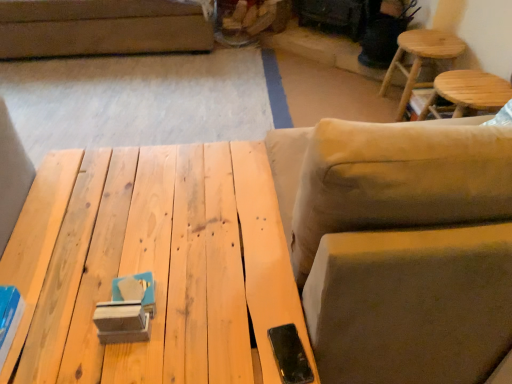
Question: Should I look upward or downward to see beige fabric swivel chair at right?

Choices:
 (A) down
 (B) up

Answer: (B)

Question: From a real-world perspective, is beige fabric swivel chair at right on light brown wooden stool at upper right, which ranks as the 1th stool in back-to-front order?

Choices:
 (A) yes
 (B) no

Answer: (A)

Question: Does beige fabric swivel chair at right have a lesser width compared to light brown wooden stool at upper right, which ranks as the 1th stool in back-to-front order?

Choices:
 (A) yes
 (B) no

Answer: (B)

Question: Does beige fabric swivel chair at right contain light brown wooden stool at upper right, acting as the 2th stool starting from the front?

Choices:
 (A) yes
 (B) no

Answer: (B)

Question: From a real-world perspective, is beige fabric swivel chair at right physically below light brown wooden stool at upper right, acting as the 2th stool starting from the front?

Choices:
 (A) no
 (B) yes

Answer: (A)

Question: Is beige fabric swivel chair at right aimed at light brown wooden stool at upper right, which ranks as the 1th stool in back-to-front order?

Choices:
 (A) yes
 (B) no

Answer: (A)

Question: Considering the relative sizes of beige fabric swivel chair at right and light brown wooden stool at upper right, acting as the 2th stool starting from the front, in the image provided, is beige fabric swivel chair at right shorter than light brown wooden stool at upper right, acting as the 2th stool starting from the front,?

Choices:
 (A) yes
 (B) no

Answer: (B)

Question: From the image's perspective, is light brown wooden stool at upper right, acting as the 2th stool starting from the front, on natural wood table at center?

Choices:
 (A) yes
 (B) no

Answer: (A)

Question: Is light brown wooden stool at upper right, which ranks as the 1th stool in back-to-front order, shorter than natural wood table at center?

Choices:
 (A) no
 (B) yes

Answer: (B)

Question: From a real-world perspective, is light brown wooden stool at upper right, which ranks as the 1th stool in back-to-front order, positioned over natural wood table at center based on gravity?

Choices:
 (A) yes
 (B) no

Answer: (B)

Question: Is light brown wooden stool at upper right, acting as the 2th stool starting from the front, facing away from natural wood table at center?

Choices:
 (A) yes
 (B) no

Answer: (B)

Question: Is light brown wooden stool at upper right, acting as the 2th stool starting from the front, closer to camera compared to natural wood table at center?

Choices:
 (A) yes
 (B) no

Answer: (B)

Question: Can you confirm if light brown wooden stool at upper right, acting as the 2th stool starting from the front, is thinner than natural wood table at center?

Choices:
 (A) yes
 (B) no

Answer: (A)

Question: Is wooden stool at upper right, which is counted as the first stool, starting from the front, positioned before beige fabric swivel chair at right?

Choices:
 (A) yes
 (B) no

Answer: (B)